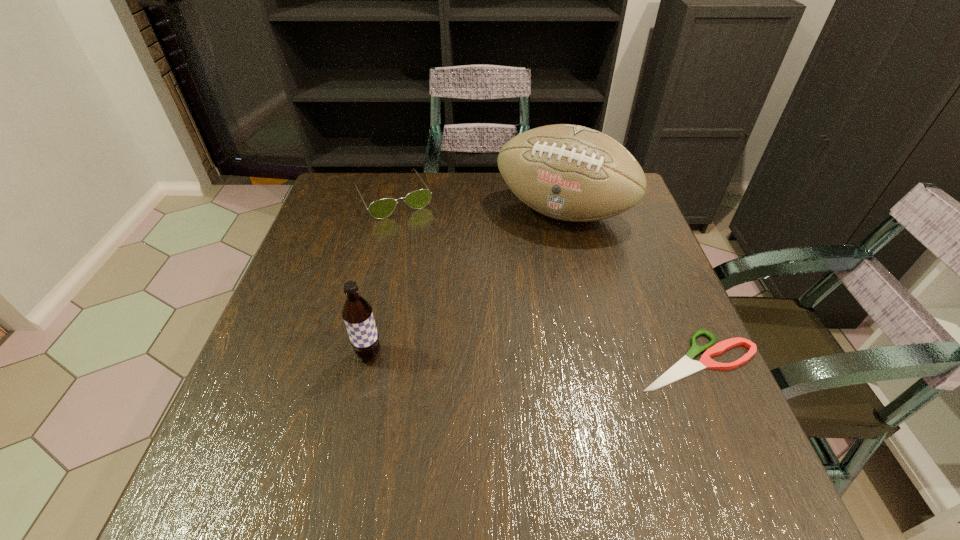
In the image, there is a desktop. Where is `vacant area at the left edge`? vacant area at the left edge is located at coordinates (293, 284).

Where is `vacant space at the right edge of the desktop`? vacant space at the right edge of the desktop is located at coordinates (638, 265).

Find the location of `vacant space at the far left corner`. vacant space at the far left corner is located at coordinates (348, 212).

Locate an element on the screen. vacant area at the near left corner is located at coordinates (247, 422).

At what (x,y) coordinates should I click in order to perform the action: click on vacant space at the far right corner of the desktop. Please return your answer as a coordinate pair (x, y). Looking at the image, I should click on (644, 216).

The height and width of the screenshot is (540, 960). I want to click on empty space that is in between the third tallest object and the scissors, so click(544, 279).

I want to click on free space between the shortest object and the root beer, so click(x=533, y=357).

At what (x,y) coordinates should I click in order to perform the action: click on free area in between the scissors and the sunglasses. Please return your answer as a coordinate pair (x, y). Looking at the image, I should click on (544, 279).

At what (x,y) coordinates should I click in order to perform the action: click on free space between the tallest object and the second shortest object. Please return your answer as a coordinate pair (x, y). Image resolution: width=960 pixels, height=540 pixels. Looking at the image, I should click on click(x=478, y=205).

What are the coordinates of `blank region between the shortest object and the tallest object` in the screenshot? It's located at (630, 286).